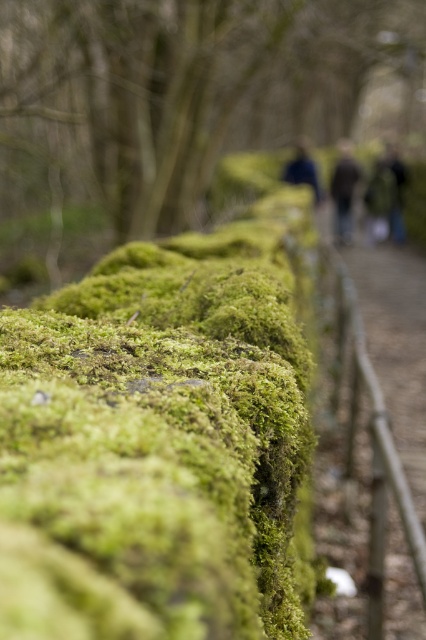
Question: Does green mossy wall at center have a smaller size compared to dark blue jacket at center?

Choices:
 (A) no
 (B) yes

Answer: (A)

Question: Can you confirm if dark green textured jacket at upper center is bigger than dark blue jacket at center?

Choices:
 (A) no
 (B) yes

Answer: (B)

Question: Does green mossy wall at center appear on the right side of dark green textured jacket at upper center?

Choices:
 (A) yes
 (B) no

Answer: (B)

Question: Among these points, which one is nearest to the camera?

Choices:
 (A) (333, 196)
 (B) (399, 177)

Answer: (B)

Question: Which of the following is the farthest from the observer?

Choices:
 (A) (371, 234)
 (B) (363, 518)
 (C) (308, 173)
 (D) (204, 385)

Answer: (A)

Question: Which object is positioned closest to the dark blue jacket at center?

Choices:
 (A) green mossy wall at center
 (B) wooden fence at upper right
 (C) dark green textured jacket at upper center

Answer: (C)